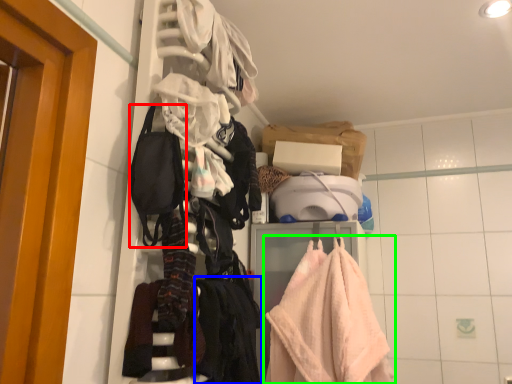
Question: Which object is the closest to the accessory (highlighted by a red box)? Choose among these: clothing (highlighted by a blue box) or towel (highlighted by a green box).

Choices:
 (A) clothing
 (B) towel

Answer: (A)